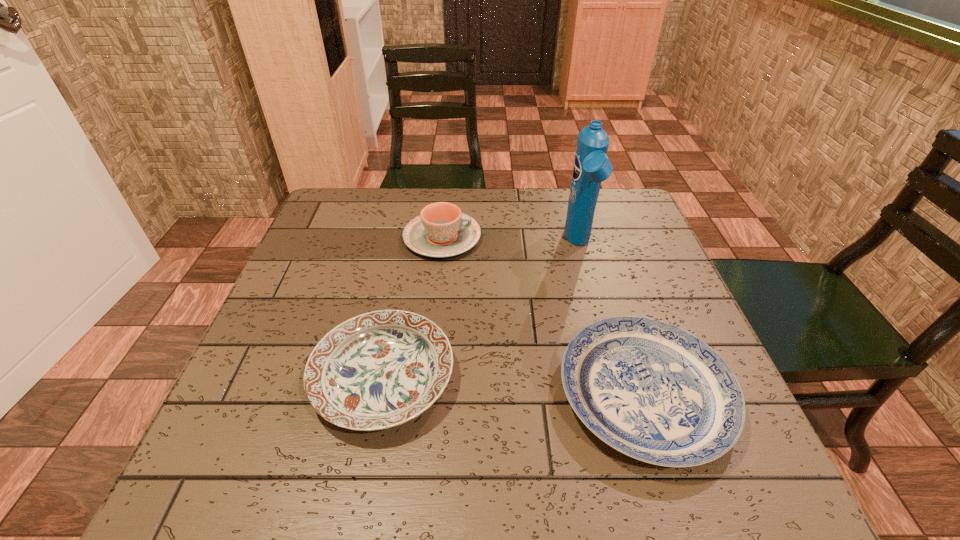
Locate an element on the screen. The image size is (960, 540). vacant space that satisfies the following two spatial constraints: 1. on the handle side of the chinaware; 2. on the left side of the right plate is located at coordinates (425, 395).

This screenshot has width=960, height=540. What are the coordinates of `vacant region that satisfies the following two spatial constraints: 1. on the handle side of the right plate; 2. on the left side of the second tallest object` in the screenshot? It's located at (425, 395).